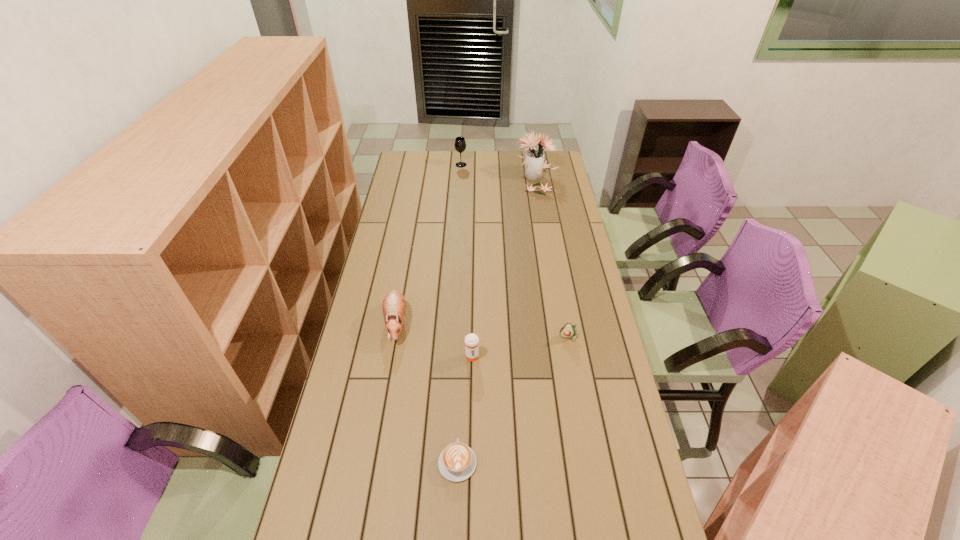
I want to click on free spot between the medicine and the nearest object, so click(x=465, y=409).

You are a GUI agent. You are given a task and a screenshot of the screen. Output one action in this format:
    pyautogui.click(x=<x>, y=<y>)
    Task: Click on the empty location between the medicine and the leftmost object
    The height and width of the screenshot is (540, 960).
    Given the screenshot: What is the action you would take?
    pyautogui.click(x=434, y=339)

Where is `vacant space in between the bouquet and the leftmost object`? The height and width of the screenshot is (540, 960). vacant space in between the bouquet and the leftmost object is located at coordinates (466, 250).

Where is `free area in between the fifth shortest object and the shortest object`? The image size is (960, 540). free area in between the fifth shortest object and the shortest object is located at coordinates (459, 313).

The width and height of the screenshot is (960, 540). What are the coordinates of `free space between the tallest object and the avocado` in the screenshot? It's located at (553, 257).

You are a GUI agent. You are given a task and a screenshot of the screen. Output one action in this format:
    pyautogui.click(x=<x>, y=<y>)
    Task: Click on the object that ranks as the second closest to the leftmost object
    The width and height of the screenshot is (960, 540).
    Given the screenshot: What is the action you would take?
    pyautogui.click(x=457, y=462)

What are the coordinates of `object that stands as the second closest to the medicine` in the screenshot? It's located at (457, 462).

You are a GUI agent. You are given a task and a screenshot of the screen. Output one action in this format:
    pyautogui.click(x=<x>, y=<y>)
    Task: Click on the free space in the image that satisfies the following two spatial constraints: 1. on the side of the bouquet with the handle; 2. on the right side of the nearest object
    
    Given the screenshot: What is the action you would take?
    pyautogui.click(x=468, y=178)